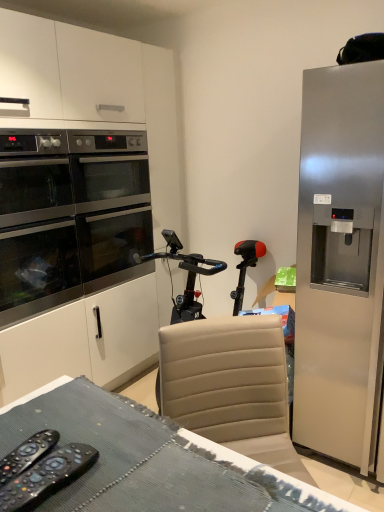
Question: Considering the relative sizes of stainless steel oven at left and satin silver refrigerator at right in the image provided, is stainless steel oven at left shorter than satin silver refrigerator at right?

Choices:
 (A) no
 (B) yes

Answer: (B)

Question: Is stainless steel oven at left at the right side of satin silver refrigerator at right?

Choices:
 (A) no
 (B) yes

Answer: (A)

Question: From a real-world perspective, does stainless steel oven at left sit lower than satin silver refrigerator at right?

Choices:
 (A) yes
 (B) no

Answer: (B)

Question: Does stainless steel oven at left appear on the left side of satin silver refrigerator at right?

Choices:
 (A) no
 (B) yes

Answer: (B)

Question: Is stainless steel oven at left positioned with its back to satin silver refrigerator at right?

Choices:
 (A) no
 (B) yes

Answer: (A)

Question: Considering the relative sizes of stainless steel oven at left and satin silver refrigerator at right in the image provided, is stainless steel oven at left bigger than satin silver refrigerator at right?

Choices:
 (A) yes
 (B) no

Answer: (B)

Question: Is black plastic remote controls at lower left, which ranks as the 2th remote control in left-to-right order, facing away from black plastic remote control at lower left, which ranks as the first remote control in left-to-right order?

Choices:
 (A) no
 (B) yes

Answer: (B)

Question: Considering the relative sizes of black plastic remote controls at lower left, the 1th remote control positioned from the right, and black plastic remote control at lower left, the second remote control when ordered from right to left, in the image provided, is black plastic remote controls at lower left, the 1th remote control positioned from the right, shorter than black plastic remote control at lower left, the second remote control when ordered from right to left,?

Choices:
 (A) yes
 (B) no

Answer: (B)

Question: Considering the relative sizes of black plastic remote controls at lower left, the 1th remote control positioned from the right, and black plastic remote control at lower left, the second remote control when ordered from right to left, in the image provided, is black plastic remote controls at lower left, the 1th remote control positioned from the right, bigger than black plastic remote control at lower left, the second remote control when ordered from right to left,?

Choices:
 (A) yes
 (B) no

Answer: (A)

Question: Is black plastic remote controls at lower left, which ranks as the 2th remote control in left-to-right order, in contact with black plastic remote control at lower left, which ranks as the first remote control in left-to-right order?

Choices:
 (A) yes
 (B) no

Answer: (A)

Question: Does black plastic remote controls at lower left, the 1th remote control positioned from the right, turn towards black plastic remote control at lower left, which ranks as the first remote control in left-to-right order?

Choices:
 (A) no
 (B) yes

Answer: (A)

Question: From a real-world perspective, is black plastic remote controls at lower left, the 1th remote control positioned from the right, on black plastic remote control at lower left, the second remote control when ordered from right to left?

Choices:
 (A) no
 (B) yes

Answer: (B)

Question: Can you confirm if stainless steel oven at left is positioned to the right of black plastic remote control at lower left, which ranks as the first remote control in left-to-right order?

Choices:
 (A) yes
 (B) no

Answer: (B)